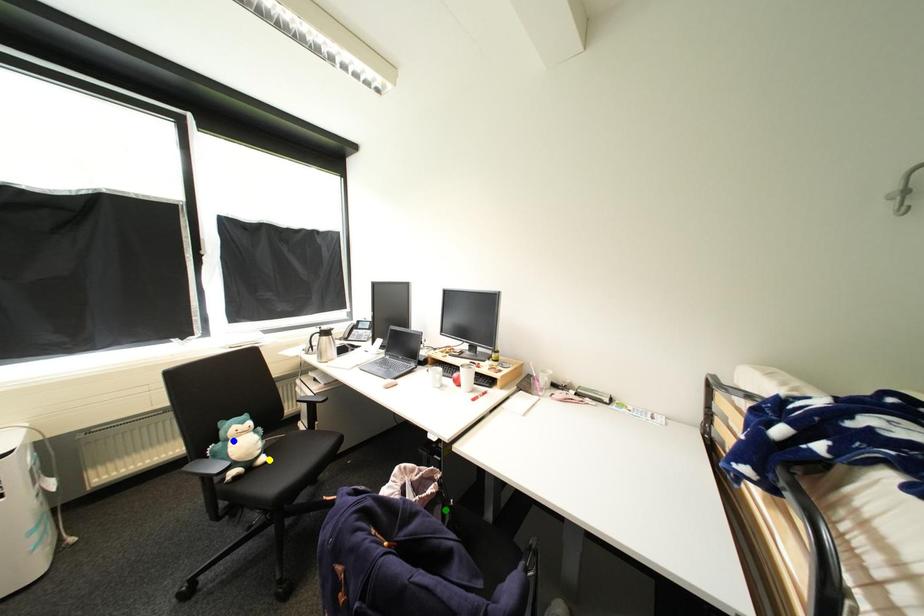
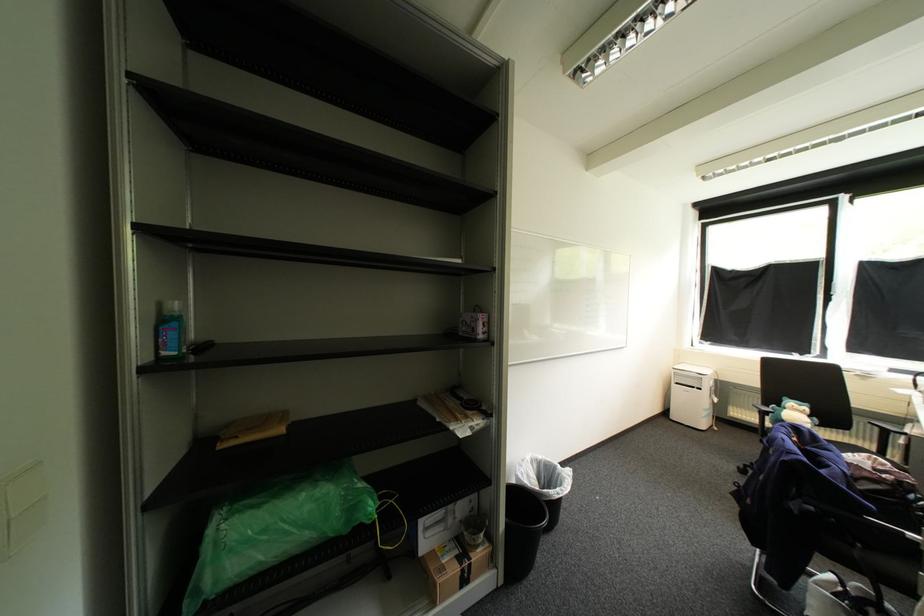
I am providing you with two images of the same scene from different viewpoints. Three points are marked in image1. Which point corresponds to a part or object that is occluded in image2?In image1, three points are marked. Which of them correspond to a part or object that is occluded in image2?Among the three points shown in image1, which one corresponds to a part or object that is no longer visible due to occlusion in image2?

yellow point cannot be seen in image2.